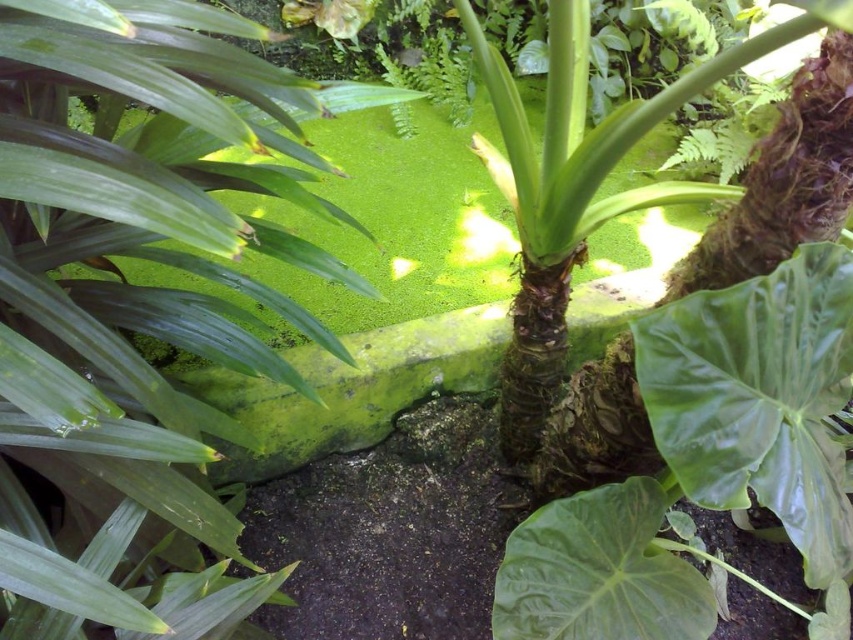
Question: Which of the following is the closest to the observer?

Choices:
 (A) green glossy leaf at center
 (B) green matte leaf at center

Answer: (A)

Question: Where is green glossy leaf at center located in relation to green matte leaf at center in the image?

Choices:
 (A) right
 (B) left

Answer: (A)

Question: Which of the following is the farthest from the observer?

Choices:
 (A) (563, 572)
 (B) (756, 307)

Answer: (A)

Question: Does green glossy leaf at center have a greater width compared to green matte leaf at center?

Choices:
 (A) yes
 (B) no

Answer: (A)

Question: Can you confirm if green glossy leaf at center is smaller than green matte leaf at center?

Choices:
 (A) no
 (B) yes

Answer: (A)